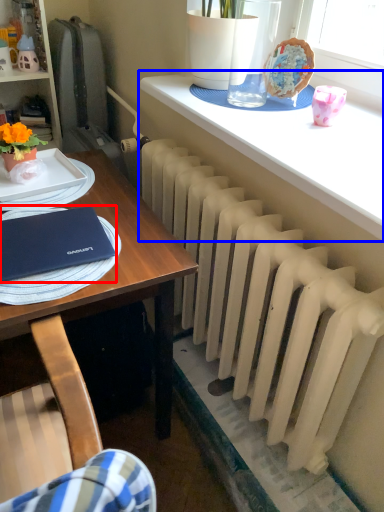
Question: Which point is further to the camera, notebook (highlighted by a red box) or table (highlighted by a blue box)?

Choices:
 (A) notebook
 (B) table

Answer: (A)